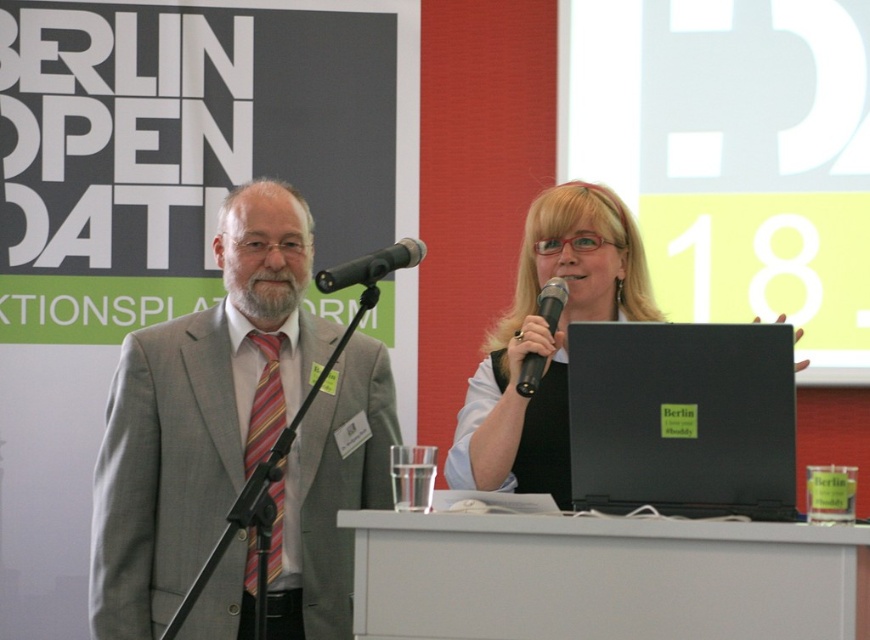
You are a speaker at the event and need to adjust the distance between the black metallic microphone at center and the black plastic microphone at upper center to exactly 30 centimeters. Given their current distance is 33.79 centimeters, how much closer should you move one of them?

The current distance between the black metallic microphone at center and the black plastic microphone at upper center is 33.79 centimeters. To reduce it to 30 centimeters, you need to move one microphone closer by 3.79 centimeters.

You are attending the event and want to ask a question to the speaker. You see the gray suit at left and the black metallic microphone at center. Which object is closer to you, the attendee?

The gray suit at left is closer to you because the black metallic microphone at center is behind it.

You are organizing a presentation and need to place a name tag on the table between the black matte laptop at center and the black metallic microphone at center. Given that the name tag is 15 cm wide, will it fit without overlapping either object?

The black matte laptop at center is bigger than the black metallic microphone at center, but the exact dimensions of the space between them are not provided. Therefore, it is uncertain if the 15 cm wide name tag will fit without overlapping either object.